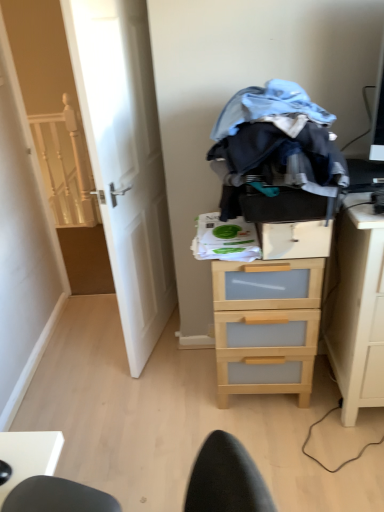
Find the location of `vacant location below white wooden door at left (from a real-world perspective)`. vacant location below white wooden door at left (from a real-world perspective) is located at coordinates (163, 340).